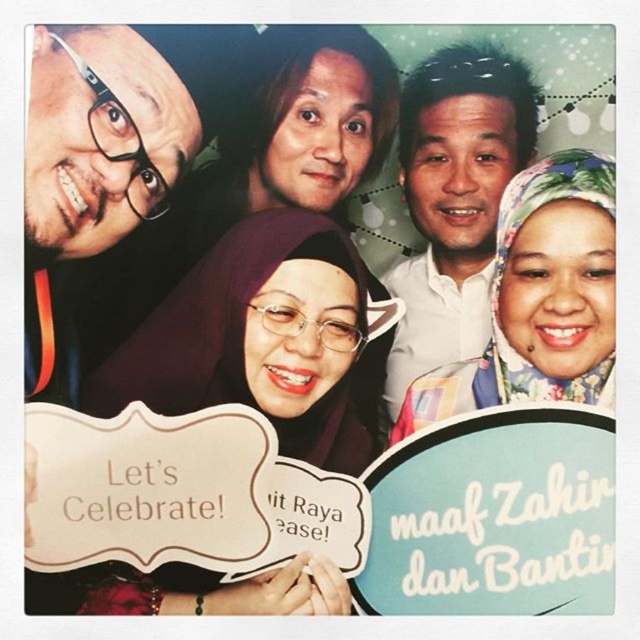
Is matte black glasses at left taller than white shirt at center?

In fact, matte black glasses at left may be shorter than white shirt at center.

What do you see at coordinates (106, 156) in the screenshot?
I see `matte black glasses at left` at bounding box center [106, 156].

Is point (116, 83) farther from viewer compared to point (483, 100)?

No, (116, 83) is closer to viewer.

The height and width of the screenshot is (640, 640). Find the location of `matte black glasses at left`. matte black glasses at left is located at coordinates (106, 156).

Does matte black glasses at left have a smaller size compared to floral fabric hijab at upper right?

Actually, matte black glasses at left might be larger than floral fabric hijab at upper right.

Is matte black glasses at left shorter than floral fabric hijab at upper right?

No.

Does point (88, 163) come behind point (557, 269)?

No, it is in front of (557, 269).

You are a GUI agent. You are given a task and a screenshot of the screen. Output one action in this format:
    pyautogui.click(x=<x>, y=<y>)
    Task: Click on the matte black glasses at left
    
    Given the screenshot: What is the action you would take?
    pyautogui.click(x=106, y=156)

Is the position of matte brown hijab at center less distant than that of floral fabric hijab at upper right?

Yes, matte brown hijab at center is closer to the viewer.

This screenshot has width=640, height=640. What do you see at coordinates (256, 339) in the screenshot?
I see `matte brown hijab at center` at bounding box center [256, 339].

Where is `matte brown hijab at center`? The height and width of the screenshot is (640, 640). matte brown hijab at center is located at coordinates (256, 339).

Identify the location of matte brown hijab at center. This screenshot has width=640, height=640. (256, 339).